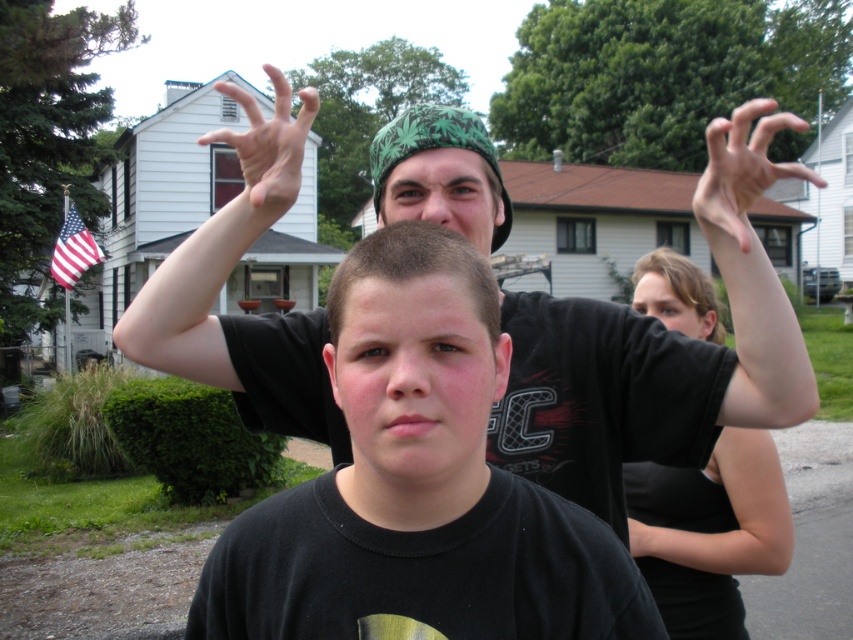
Question: Which point is farther to the camera?

Choices:
 (A) american flag at left
 (B) black matte head at center
 (C) green fabric cap at center

Answer: (A)

Question: Which object is positioned closest to the green fabric cap at center?

Choices:
 (A) black matte shirt at upper center
 (B) black matte head at center
 (C) black matte shirt at upper right

Answer: (A)

Question: Observing the image, what is the correct spatial positioning of black matte shirt at upper right in reference to pinkish skin tone hand at upper right?

Choices:
 (A) right
 (B) left

Answer: (B)

Question: From the image, what is the correct spatial relationship of black matte shirt at center in relation to brown hair at upper center?

Choices:
 (A) left
 (B) right

Answer: (A)

Question: Does pinkish skin tone hand at upper right come in front of green fabric cap at center?

Choices:
 (A) yes
 (B) no

Answer: (A)

Question: Which point is closer to the camera?

Choices:
 (A) brown hair at upper center
 (B) matte black hand at upper center
 (C) black matte head at center
 (D) black matte shirt at upper right

Answer: (C)